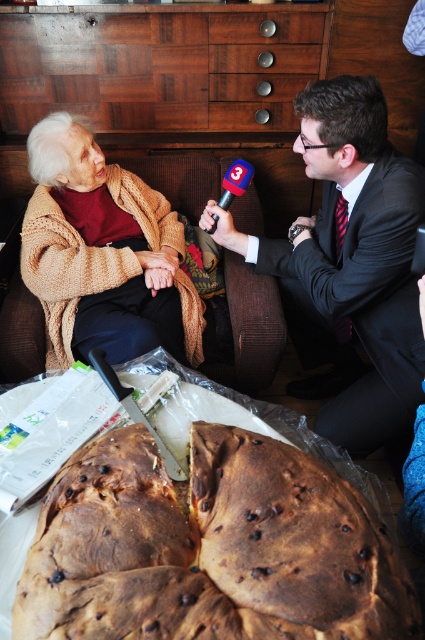
Question: Which point appears farthest from the camera in this image?

Choices:
 (A) (81, 234)
 (B) (365, 557)

Answer: (A)

Question: Among these objects, which one is nearest to the camera?

Choices:
 (A) knitted beige sweater at upper left
 (B) brown crumbly bread at center

Answer: (B)

Question: Does dark suit at center have a greater width compared to knitted beige sweater at upper left?

Choices:
 (A) yes
 (B) no

Answer: (A)

Question: Is brown crumbly bread at center in front of dark suit at center?

Choices:
 (A) no
 (B) yes

Answer: (B)

Question: Considering the relative positions of brown crumbly bread at center and knitted beige sweater at upper left in the image provided, where is brown crumbly bread at center located with respect to knitted beige sweater at upper left?

Choices:
 (A) below
 (B) above

Answer: (A)

Question: Which point is closer to the camera?

Choices:
 (A) knitted beige sweater at upper left
 (B) dark suit at center
 (C) brown crumbly bread at center

Answer: (C)